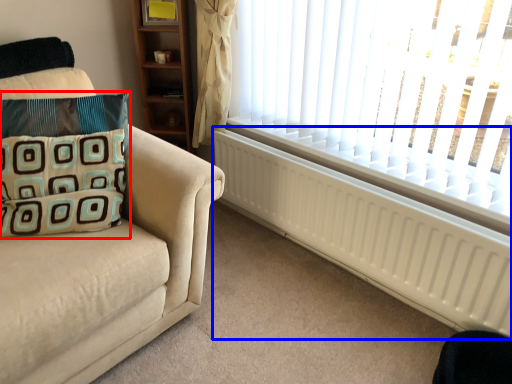
Question: Which point is closer to the camera, pillow (highlighted by a red box) or radiator (highlighted by a blue box)?

Choices:
 (A) pillow
 (B) radiator

Answer: (A)